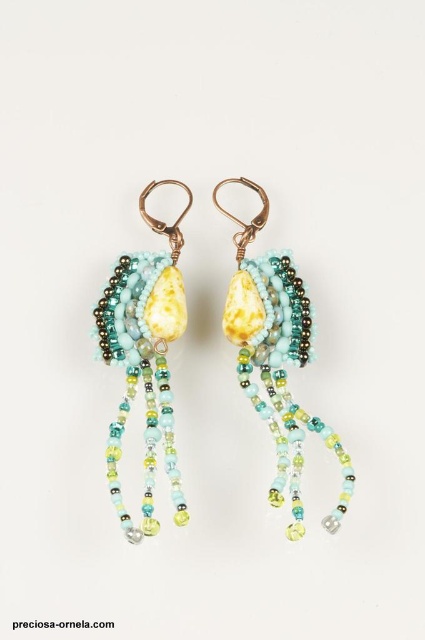
Question: Does matte glass bead earring at left have a larger size compared to matte yellow stone at center?

Choices:
 (A) yes
 (B) no

Answer: (B)

Question: Among these points, which one is farthest from the camera?

Choices:
 (A) (147, 275)
 (B) (252, 333)

Answer: (A)

Question: Does matte glass bead earring at left come behind matte yellow stone at center?

Choices:
 (A) no
 (B) yes

Answer: (A)

Question: Does matte glass bead earring at left have a greater width compared to matte yellow stone at center?

Choices:
 (A) no
 (B) yes

Answer: (A)